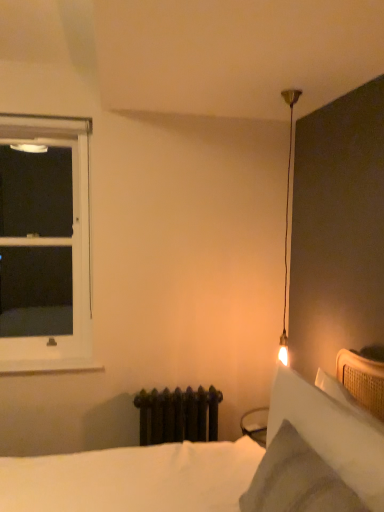
Identify the location of white plastic window at left. This screenshot has height=512, width=384. (45, 240).

Measure the distance between white soft bed at lower right and camera.

1.03 meters.

Image resolution: width=384 pixels, height=512 pixels. What are the coordinates of `white plastic window at left` in the screenshot? It's located at (45, 240).

Is white matte window sill at lower left not near white plastic window at left?

Indeed, white matte window sill at lower left is not near white plastic window at left.

Where is `window that appears on the left of white matte window sill at lower left`? window that appears on the left of white matte window sill at lower left is located at coordinates (45, 240).

From the image's perspective, between white matte window sill at lower left and white plastic window at left, who is located below?

white matte window sill at lower left is shown below in the image.

Is white matte window sill at lower left wider or thinner than white plastic window at left?

Considering their sizes, white matte window sill at lower left looks slimmer than white plastic window at left.

Considering the relative sizes of white soft bed at lower right and white matte window sill at lower left in the image provided, is white soft bed at lower right bigger than white matte window sill at lower left?

Indeed, white soft bed at lower right has a larger size compared to white matte window sill at lower left.

Is white soft bed at lower right beside white matte window sill at lower left?

No, white soft bed at lower right is not making contact with white matte window sill at lower left.

Between white plastic window at left and white soft bed at lower right, which one has more height?

white plastic window at left is taller.

From the image's perspective, relative to white soft bed at lower right, is white plastic window at left above or below?

Based on their image positions, white plastic window at left is located above white soft bed at lower right.

Can we say white plastic window at left lies outside white soft bed at lower right?

Yes, white plastic window at left is outside of white soft bed at lower right.

From the picture: Looking at the image, does white plastic window at left seem bigger or smaller compared to white soft bed at lower right?

Clearly, white plastic window at left is smaller in size than white soft bed at lower right.

Is white soft bed at lower right surrounding white soft pillow at upper right?

Indeed, white soft pillow at upper right is located within white soft bed at lower right.

Based on the photo, does white soft bed at lower right appear on the left side of white soft pillow at upper right?

Yes, white soft bed at lower right is to the left of white soft pillow at upper right.

Is point (372, 483) closer to camera compared to point (24, 297)?

Yes, it is.

In the scene shown: Is white soft pillow at upper right touching white plastic window at left?

No, white soft pillow at upper right is not making contact with white plastic window at left.

In the scene shown: Is white soft pillow at upper right facing away from white plastic window at left?

No, white soft pillow at upper right is not facing away from white plastic window at left.

At what (x,y) coordinates should I click in order to perform the action: click on window sill lying below the white plastic window at left (from the image's perspective). Please return your answer as a coordinate pair (x, y). Image resolution: width=384 pixels, height=512 pixels. Looking at the image, I should click on (48, 368).

Which object is closer to the camera, white plastic window at left or white matte window sill at lower left?

white plastic window at left is in front.

Considering the relative positions of white plastic window at left and white matte window sill at lower left in the image provided, is white plastic window at left to the right of white matte window sill at lower left from the viewer's perspective?

No.

Considering the sizes of objects white plastic window at left and white soft pillow at upper right in the image provided, who is taller, white plastic window at left or white soft pillow at upper right?

white plastic window at left.

Measure the distance between white plastic window at left and white soft pillow at upper right.

The distance of white plastic window at left from white soft pillow at upper right is 5.04 meters.

Looking at this image, could you tell me if white plastic window at left is facing white soft pillow at upper right?

No, white plastic window at left is not oriented towards white soft pillow at upper right.

Can you confirm if white plastic window at left is smaller than white soft pillow at upper right?

Actually, white plastic window at left might be larger than white soft pillow at upper right.

Where is `window on the left of white matte window sill at lower left`? window on the left of white matte window sill at lower left is located at coordinates (45, 240).

The height and width of the screenshot is (512, 384). I want to click on window sill behind the white soft bed at lower right, so click(x=48, y=368).

Estimate the real-world distances between objects in this image. Which object is further from white soft pillow at upper right, white plastic window at left or white soft bed at lower right?

Based on the image, white plastic window at left appears to be further to white soft pillow at upper right.

Based on their spatial positions, is white soft pillow at upper right or white soft bed at lower right closer to white plastic window at left?

Based on the image, white soft bed at lower right appears to be nearer to white plastic window at left.

Which object lies further to the anchor point white matte window sill at lower left, white soft pillow at upper right or white plastic window at left?

white plastic window at left is further to white matte window sill at lower left.

When comparing their distances from white plastic window at left, does white soft pillow at upper right or white matte window sill at lower left seem closer?

Among the two, white matte window sill at lower left is located nearer to white plastic window at left.

From the image, which object appears to be farther from white matte window sill at lower left, white plastic window at left or white soft bed at lower right?

Based on the image, white plastic window at left appears to be further to white matte window sill at lower left.

From the picture: Considering their positions, is white plastic window at left positioned closer to white matte window sill at lower left than white soft pillow at upper right?

white soft pillow at upper right is positioned closer to the anchor white matte window sill at lower left.

Estimate the real-world distances between objects in this image. Which object is closer to white soft pillow at upper right, white soft bed at lower right or white matte window sill at lower left?

white soft bed at lower right.

In the scene shown: Based on their spatial positions, is white matte window sill at lower left or white soft bed at lower right further from white soft pillow at upper right?

white matte window sill at lower left is positioned further to the anchor white soft pillow at upper right.

Find the location of a particular element. Image resolution: width=384 pixels, height=512 pixels. window between white soft bed at lower right and white matte window sill at lower left in the front-back direction is located at coordinates (45, 240).

Identify the location of pillow positioned between white soft bed at lower right and white plastic window at left from near to far. (332, 430).

The image size is (384, 512). In order to click on pillow positioned between white soft bed at lower right and white matte window sill at lower left from near to far in this screenshot , I will do `click(332, 430)`.

This screenshot has width=384, height=512. I want to click on window sill between white plastic window at left and white soft pillow at upper right in the horizontal direction, so click(48, 368).